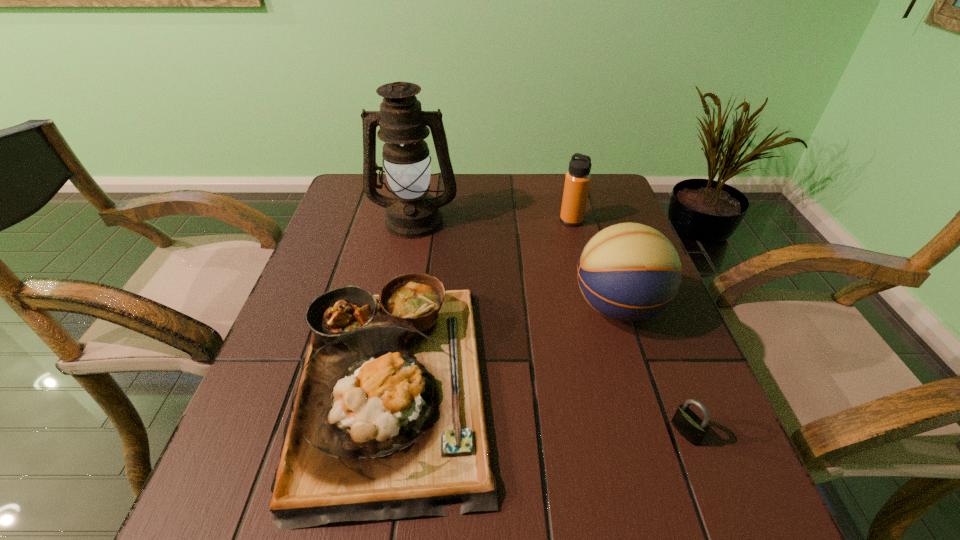
I want to click on unoccupied area between the platter and the thermos bottle, so click(482, 301).

Identify the location of vacant space that is in between the platter and the padlock. Image resolution: width=960 pixels, height=540 pixels. (539, 407).

Find the location of a particular element. This screenshot has height=540, width=960. vacant area between the oil lamp and the basketball is located at coordinates (516, 264).

Locate an element on the screen. free space between the platter and the basketball is located at coordinates (505, 345).

This screenshot has width=960, height=540. What are the coordinates of `vacant space that is in between the padlock and the basketball` in the screenshot? It's located at (652, 369).

This screenshot has width=960, height=540. Identify the location of free space between the basketball and the tallest object. (516, 264).

Locate an element on the screen. empty space between the tallest object and the basketball is located at coordinates (516, 264).

Point out which object is positioned as the nearest to the thermos bottle. Please provide its 2D coordinates. Your answer should be formatted as a tuple, i.e. [(x, y)], where the tuple contains the x and y coordinates of a point satisfying the conditions above.

[(628, 272)]

Identify which object is the third nearest to the basketball. Please provide its 2D coordinates. Your answer should be formatted as a tuple, i.e. [(x, y)], where the tuple contains the x and y coordinates of a point satisfying the conditions above.

[(577, 181)]

Locate an element on the screen. free spot that satisfies the following two spatial constraints: 1. on the patterned surface of the padlock; 2. on the right side of the basketball is located at coordinates (658, 432).